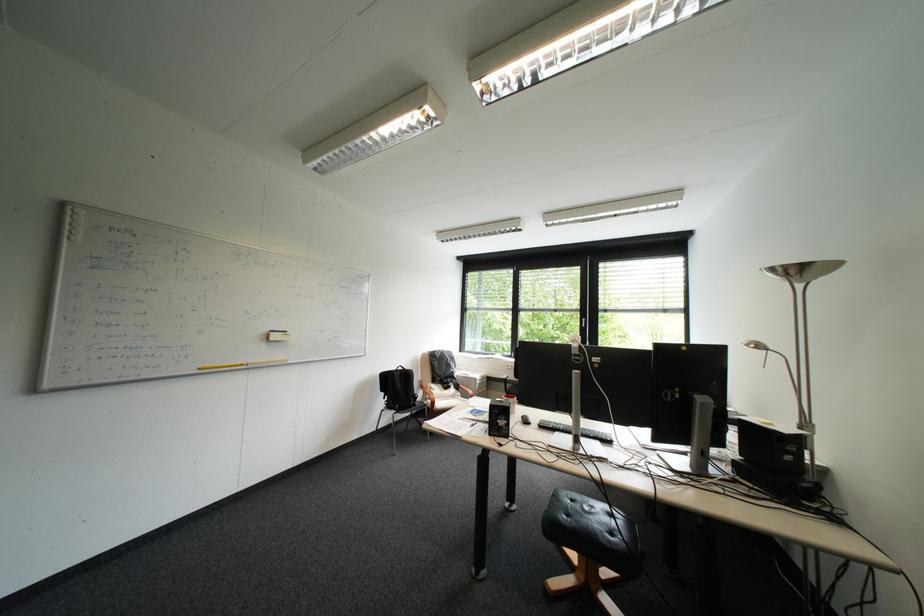
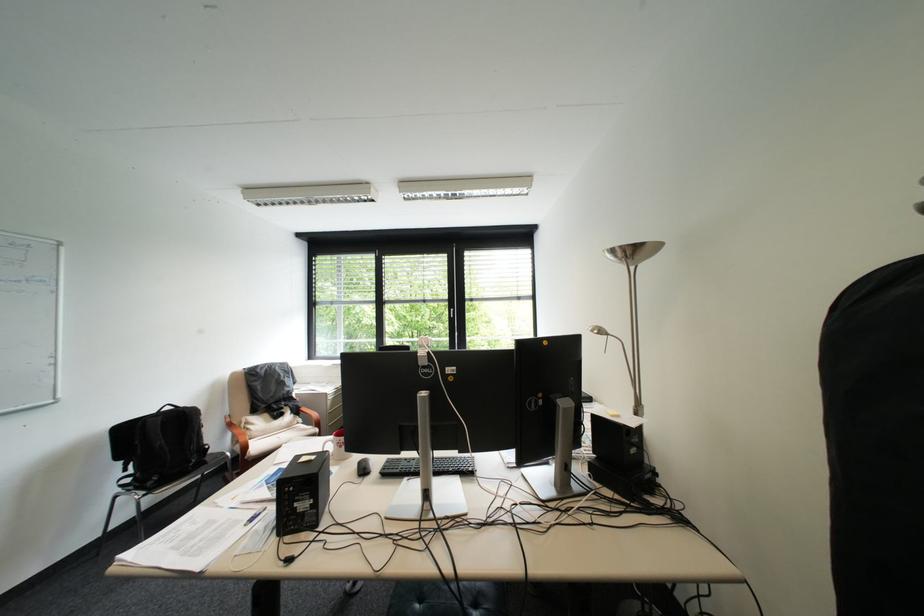
Find the pixel in the second image that matches pixel 441 389 in the first image.

(256, 424)